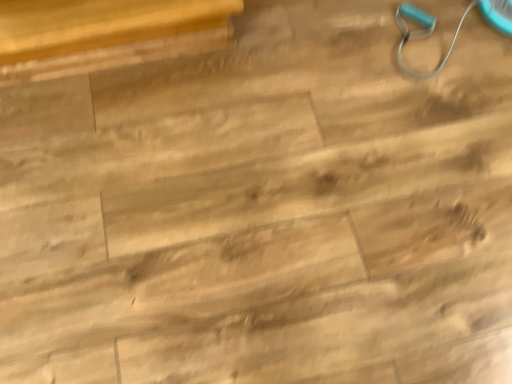
Question: Should I look upward or downward to see wooden table at upper left?

Choices:
 (A) down
 (B) up

Answer: (B)